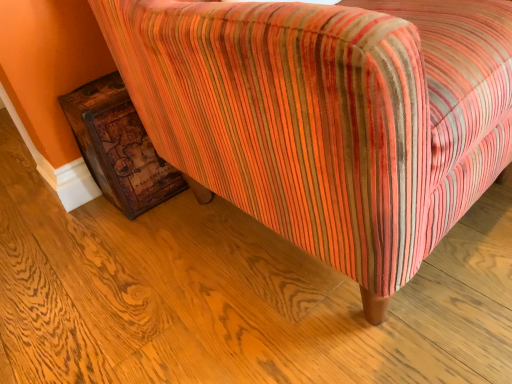
Identify the location of vacant point to the left of distressed wood trunk at lower left. This screenshot has height=384, width=512. (69, 218).